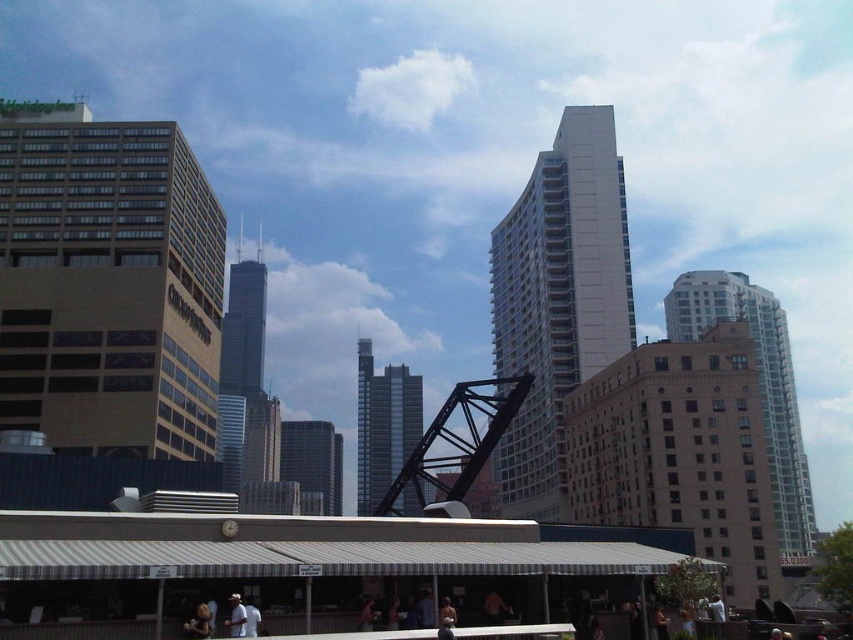
Question: Does brown/matte building at left appear on the right side of shiny glass skyscraper at center?

Choices:
 (A) no
 (B) yes

Answer: (B)

Question: Among these objects, which one is farthest from the camera?

Choices:
 (A) white glass building at center
 (B) shiny glass skyscraper at center
 (C) light brown leather jacket at lower left

Answer: (A)

Question: Does light brown leather jacket at lower left appear on the left side of white fabric hat at lower center?

Choices:
 (A) yes
 (B) no

Answer: (A)

Question: Is light brown leather jacket at lower left in front of white fabric shirt at lower center?

Choices:
 (A) no
 (B) yes

Answer: (A)

Question: Which point is closer to the camera?

Choices:
 (A) brown/matte building at left
 (B) smooth glass skyscraper at center
 (C) brown brick building at right

Answer: (C)

Question: Which object appears farthest from the camera in this image?

Choices:
 (A) brown/matte building at left
 (B) white glass building at center

Answer: (B)